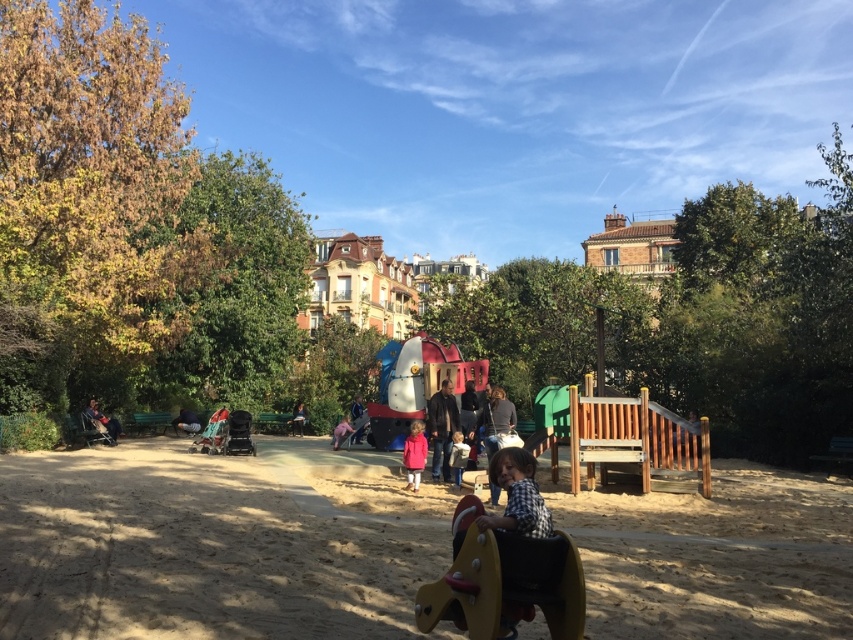
You are a parent looking for a place to sit while watching your child play on the yellow and black swing. You notice the brown sandy playground at center and the matte pink coat at center. Which one is shorter and thus a better option for sitting?

The brown sandy playground at center is not as tall as the matte pink coat at center, so the brown sandy playground at center is shorter and a better option for sitting.